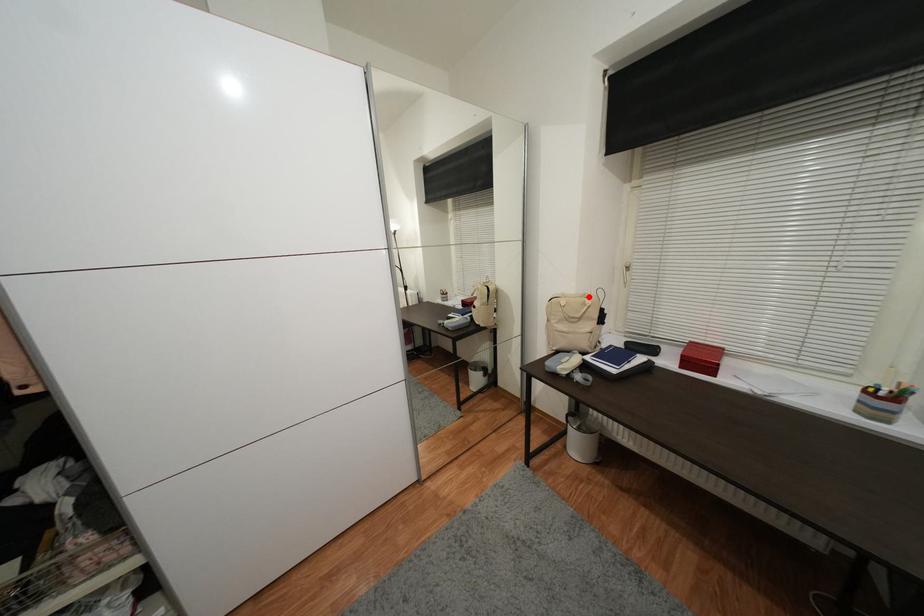
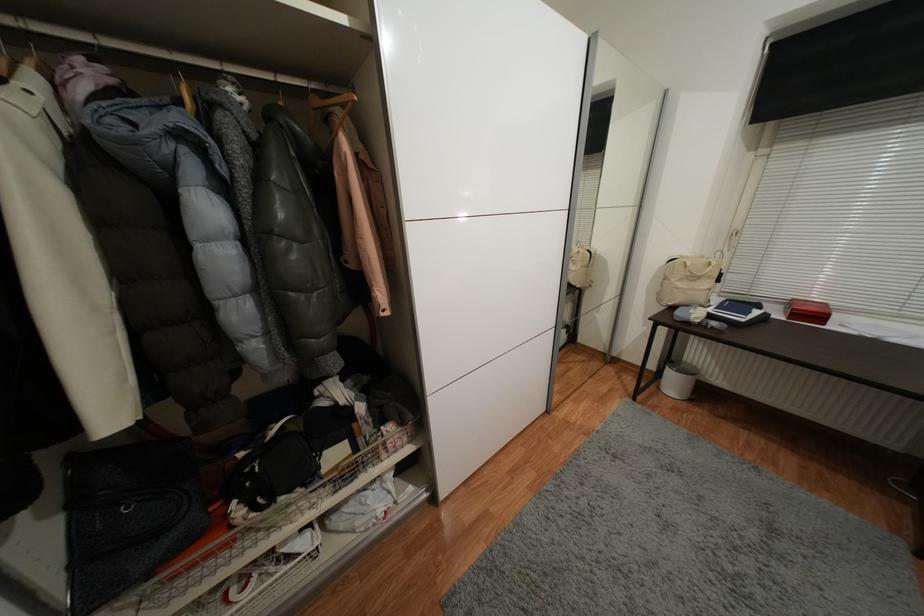
In the second image, find the point that corresponds to the highlighted location in the first image.

(707, 257)